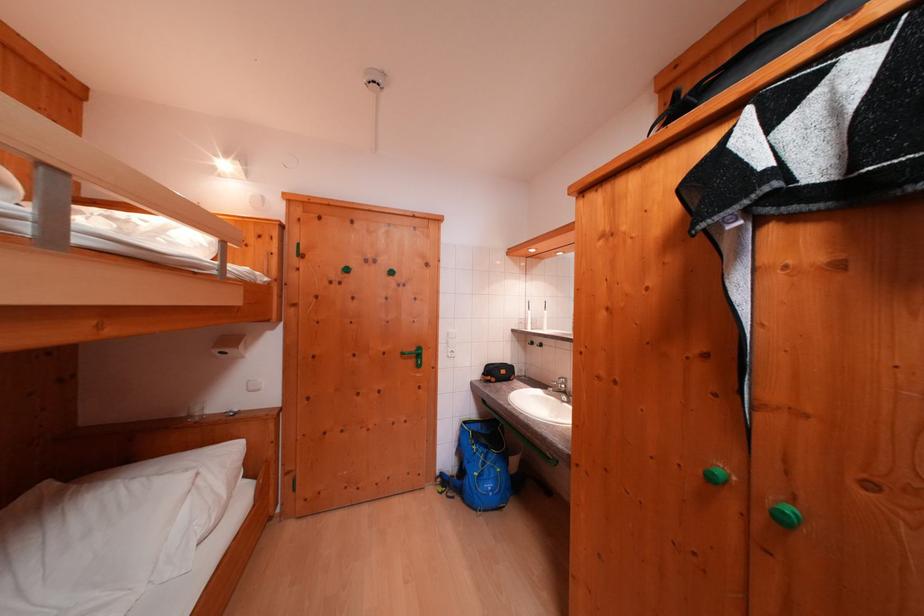
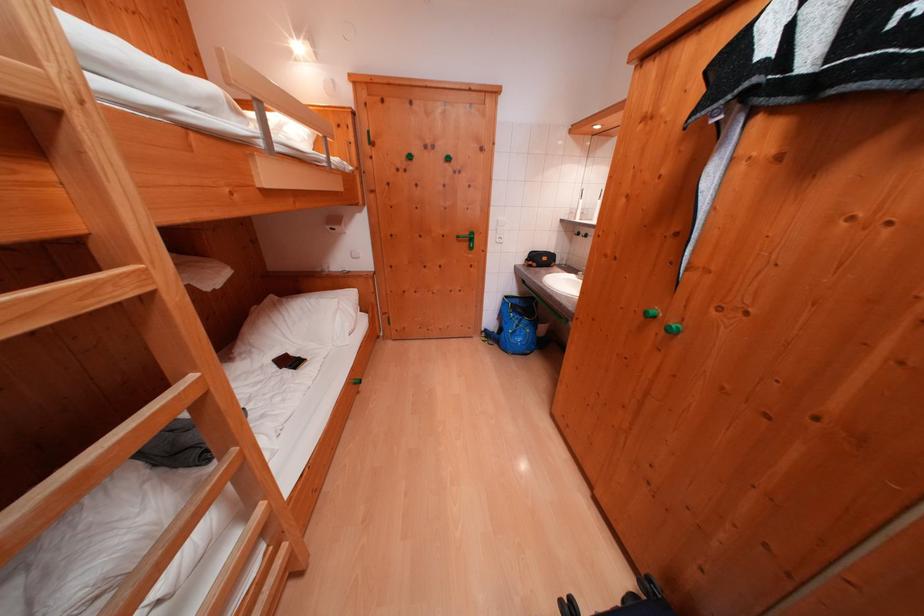
Where in the second image is the point corresponding to (410,358) from the first image?

(466, 241)